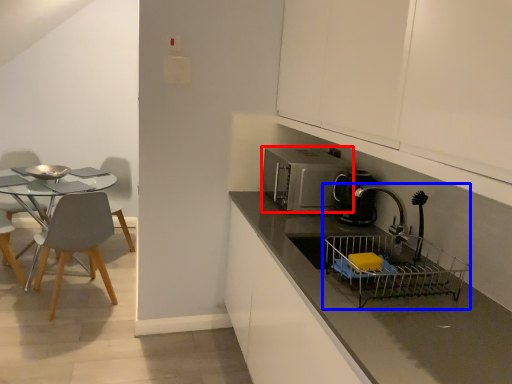
Question: Which object appears farthest to the camera in this image, microwave oven (highlighted by a red box) or sink (highlighted by a blue box)?

Choices:
 (A) microwave oven
 (B) sink

Answer: (A)